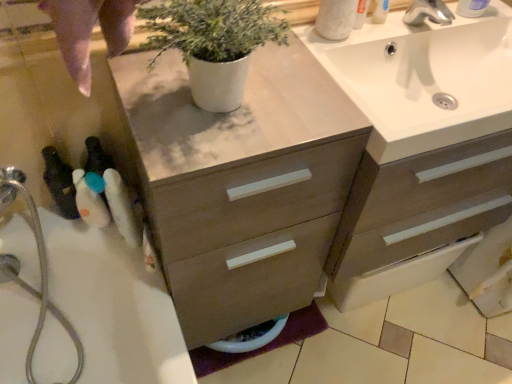
Measure the distance between white fluffy brush at left, the 4th toiletry in the top-to-bottom sequence, and camera.

white fluffy brush at left, the 4th toiletry in the top-to-bottom sequence, and camera are 34.06 inches apart from each other.

This screenshot has width=512, height=384. Describe the element at coordinates (336, 19) in the screenshot. I see `white matte toilet paper at upper right` at that location.

What is the approximate height of white matte toilet paper at upper right?

The height of white matte toilet paper at upper right is 4.35 inches.

In order to face white glossy pot at center, should I rotate leftwards or rightwards?

It's best to rotate left around 3.760 degrees.

Locate an element on the screen. This screenshot has height=384, width=512. silver metallic faucet at upper right is located at coordinates (428, 13).

Who is more distant, white matte toilet paper at upper right or white fluffy brush at left, which is the first toiletry in bottom-to-top order?

white matte toilet paper at upper right is more distant.

Measure the distance from white matte toilet paper at upper right to white fluffy brush at left, positioned as the 2th toiletry in right-to-left order.

white matte toilet paper at upper right is 57.23 centimeters from white fluffy brush at left, positioned as the 2th toiletry in right-to-left order.

Which is more to the right, white matte toilet paper at upper right or white fluffy brush at left, acting as the 3th toiletry starting from the left?

Positioned to the right is white matte toilet paper at upper right.

Can you tell me how much white plastic soap dispenser at upper right, the fourth toiletry when ordered from bottom to top, and white matte toilet paper at upper right differ in facing direction?

The angular difference between white plastic soap dispenser at upper right, the fourth toiletry when ordered from bottom to top, and white matte toilet paper at upper right is 0.00263 degrees.

Which object is thinner, white plastic soap dispenser at upper right, the fourth toiletry when ordered from bottom to top, or white matte toilet paper at upper right?

white matte toilet paper at upper right is thinner.

Considering the relative positions of white plastic soap dispenser at upper right, positioned as the 1th toiletry in top-to-bottom order, and white matte toilet paper at upper right in the image provided, is white plastic soap dispenser at upper right, positioned as the 1th toiletry in top-to-bottom order, to the left or to the right of white matte toilet paper at upper right?

From the image, it's evident that white plastic soap dispenser at upper right, positioned as the 1th toiletry in top-to-bottom order, is to the right of white matte toilet paper at upper right.

From a real-world perspective, is white plastic soap dispenser at upper right, the fourth toiletry when ordered from bottom to top, positioned above or below white matte toilet paper at upper right?

white plastic soap dispenser at upper right, the fourth toiletry when ordered from bottom to top, is above white matte toilet paper at upper right.

Looking at this image, between white plastic soap dispenser at upper right, the fourth toiletry from the left, and silvery metallic garden hose at lower left, which one has more height?

silvery metallic garden hose at lower left is taller.

Do you think white plastic soap dispenser at upper right, the fourth toiletry from the left, is within silvery metallic garden hose at lower left, or outside of it?

white plastic soap dispenser at upper right, the fourth toiletry from the left, is located beyond the bounds of silvery metallic garden hose at lower left.

Which object is positioned more to the left, white plastic soap dispenser at upper right, the fourth toiletry when ordered from bottom to top, or silvery metallic garden hose at lower left?

silvery metallic garden hose at lower left.

Is white plastic soap dispenser at upper right, the fourth toiletry when ordered from bottom to top, placed right next to silvery metallic garden hose at lower left?

white plastic soap dispenser at upper right, the fourth toiletry when ordered from bottom to top, and silvery metallic garden hose at lower left are clearly separated.

From a real-world perspective, which is physically below, silvery metallic garden hose at lower left or white matte toilet paper at upper right?

From a 3D spatial view, silvery metallic garden hose at lower left is below.

Which is less distant, (22, 288) or (324, 36)?

Clearly, point (22, 288) is more distant from the camera than point (324, 36).

Which of these two, silvery metallic garden hose at lower left or white matte toilet paper at upper right, stands shorter?

Standing shorter between the two is white matte toilet paper at upper right.

What's the angular difference between white glossy pot at center and white fluffy brush at left, the 4th toiletry in the top-to-bottom sequence,'s facing directions?

0.269 degrees.

Find the location of a particular element. The width and height of the screenshot is (512, 384). the 1st toiletry counting from the left side of the white glossy pot at center is located at coordinates (121, 207).

From the image's perspective, relative to white fluffy brush at left, the 4th toiletry in the top-to-bottom sequence, is white glossy pot at center above or below?

white glossy pot at center is situated higher than white fluffy brush at left, the 4th toiletry in the top-to-bottom sequence, in the image.

From a real-world perspective, between white glossy pot at center and white fluffy brush at left, the 4th toiletry in the top-to-bottom sequence, who is vertically lower?

In real-world perspective, white fluffy brush at left, the 4th toiletry in the top-to-bottom sequence, is lower.

From the image's perspective, who appears lower, white fluffy brush at left, which is the first toiletry in bottom-to-top order, or silver metallic faucet at upper right?

white fluffy brush at left, which is the first toiletry in bottom-to-top order.

From a real-world perspective, is white fluffy brush at left, which is the first toiletry in bottom-to-top order, located higher than silver metallic faucet at upper right?

No, from a real-world perspective, white fluffy brush at left, which is the first toiletry in bottom-to-top order, is not above silver metallic faucet at upper right.

Which object is wider, white fluffy brush at left, the 4th toiletry in the top-to-bottom sequence, or silver metallic faucet at upper right?

Wider between the two is silver metallic faucet at upper right.

Do you think white fluffy brush at left, positioned as the 2th toiletry in right-to-left order, is within silver metallic faucet at upper right, or outside of it?

white fluffy brush at left, positioned as the 2th toiletry in right-to-left order, is not enclosed by silver metallic faucet at upper right.

Between point (106, 216) and point (429, 8), which one is positioned behind?

Positioned behind is point (429, 8).

From the image's perspective, is white plastic bottle at lower left, which is counted as the 2th toiletry, starting from the left, located above or below silver metallic faucet at upper right?

Clearly, from the image's perspective, white plastic bottle at lower left, which is counted as the 2th toiletry, starting from the left, is below silver metallic faucet at upper right.

Considering the relative positions of white plastic bottle at lower left, which is the second toiletry from bottom to top, and silver metallic faucet at upper right in the image provided, is white plastic bottle at lower left, which is the second toiletry from bottom to top, to the left of silver metallic faucet at upper right from the viewer's perspective?

Yes, white plastic bottle at lower left, which is the second toiletry from bottom to top, is to the left of silver metallic faucet at upper right.

Does white plastic bottle at lower left, which ranks as the third toiletry in right-to-left order, turn towards silver metallic faucet at upper right?

No, white plastic bottle at lower left, which ranks as the third toiletry in right-to-left order, does not turn towards silver metallic faucet at upper right.

Locate an element on the screen. toiletry that is the 3rd one when counting downward from the white matte toilet paper at upper right (from the image's perspective) is located at coordinates (121, 207).

The height and width of the screenshot is (384, 512). In order to click on toiletry positioned vertically above the white matte toilet paper at upper right (from a real-world perspective) in this screenshot , I will do `click(471, 8)`.

From the image, which object appears to be farther from white glossy sink at upper right, silvery metallic garden hose at lower left or white glossy pot at center?

silvery metallic garden hose at lower left.

Based on their spatial positions, is silvery metallic garden hose at lower left or silver metallic faucet at upper right closer to white glossy sink at upper right?

silver metallic faucet at upper right lies closer to white glossy sink at upper right than the other object.

Looking at the image, which one is located further to white glossy pot at center, white plastic bottle at lower left, arranged as the third toiletry when viewed from the top, or black plastic toothbrushes at left, the 1th toiletry positioned from the left?

black plastic toothbrushes at left, the 1th toiletry positioned from the left, is further to white glossy pot at center.

Looking at the image, which one is located further to white plastic bottle at lower left, which ranks as the third toiletry in right-to-left order, white plastic soap dispenser at upper right, which appears as the 1th toiletry when viewed from the right, or black plastic toothbrushes at left, marked as the fourth toiletry in a right-to-left arrangement?

Based on the image, white plastic soap dispenser at upper right, which appears as the 1th toiletry when viewed from the right, appears to be further to white plastic bottle at lower left, which ranks as the third toiletry in right-to-left order.

Looking at the image, which one is located closer to silver metallic faucet at upper right, black plastic toothbrushes at left, the 1th toiletry positioned from the left, or silvery metallic garden hose at lower left?

The object closer to silver metallic faucet at upper right is black plastic toothbrushes at left, the 1th toiletry positioned from the left.

Considering their positions, is white plastic bottle at lower left, which ranks as the third toiletry in right-to-left order, positioned further to white plastic soap dispenser at upper right, which appears as the 1th toiletry when viewed from the right, than black plastic toothbrushes at left, the 1th toiletry positioned from the left?

black plastic toothbrushes at left, the 1th toiletry positioned from the left, lies further to white plastic soap dispenser at upper right, which appears as the 1th toiletry when viewed from the right, than the other object.

Estimate the real-world distances between objects in this image. Which object is further from white plastic bottle at lower left, which is counted as the 2th toiletry, starting from the left, white matte toilet paper at upper right or silver metallic faucet at upper right?

silver metallic faucet at upper right is further to white plastic bottle at lower left, which is counted as the 2th toiletry, starting from the left.

Looking at the image, which one is located further to white plastic bottle at lower left, which is the second toiletry from bottom to top, white glossy pot at center or silver metallic faucet at upper right?

silver metallic faucet at upper right is further to white plastic bottle at lower left, which is the second toiletry from bottom to top.

Where is `houseplant between white plastic bottle at lower left, which ranks as the third toiletry in right-to-left order, and white glossy sink at upper right`? The image size is (512, 384). houseplant between white plastic bottle at lower left, which ranks as the third toiletry in right-to-left order, and white glossy sink at upper right is located at coordinates (214, 43).

In order to click on tap between black plastic toothbrushes at left, the 2th toiletry positioned from the top, and white glossy sink at upper right, in the horizontal direction in this screenshot , I will do `click(428, 13)`.

Image resolution: width=512 pixels, height=384 pixels. I want to click on toiletry between white plastic bottle at lower left, which ranks as the third toiletry in right-to-left order, and white plastic soap dispenser at upper right, the fourth toiletry from the left, from left to right, so click(x=121, y=207).

The height and width of the screenshot is (384, 512). Identify the location of toilet paper between silvery metallic garden hose at lower left and silver metallic faucet at upper right. (336, 19).